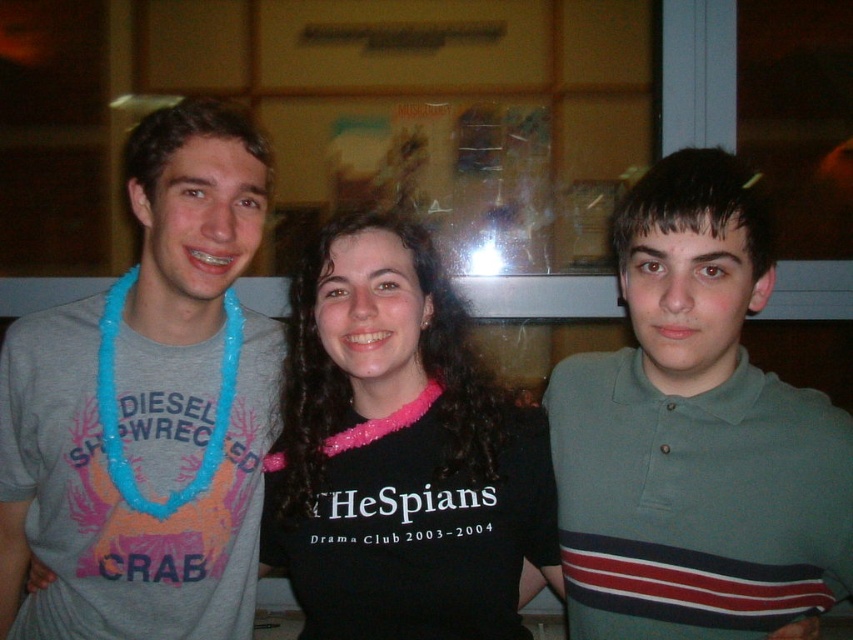
Question: Is black fabric shirt at center bigger than gray fabric neck at center?

Choices:
 (A) yes
 (B) no

Answer: (A)

Question: Can you confirm if matte gray t-shirt at left is positioned above gray fabric neck at center?

Choices:
 (A) no
 (B) yes

Answer: (A)

Question: In this image, where is green polo shirt at center located relative to blue beaded necklace at left?

Choices:
 (A) right
 (B) left

Answer: (A)

Question: Which point is closer to the camera?

Choices:
 (A) gray fabric neck at center
 (B) blue plastic lei at left
 (C) black fabric shirt at center
 (D) pink fuzzy lanyard at center

Answer: (A)

Question: Which point is farther to the camera?

Choices:
 (A) pink fabric necklace at center
 (B) gray fabric neck at center
 (C) blue plastic lei at left

Answer: (C)

Question: Which object is positioned farthest from the pink fuzzy lanyard at center?

Choices:
 (A) gray fabric neck at center
 (B) blue beaded necklace at left
 (C) matte gray t-shirt at left
 (D) black fabric shirt at center

Answer: (C)